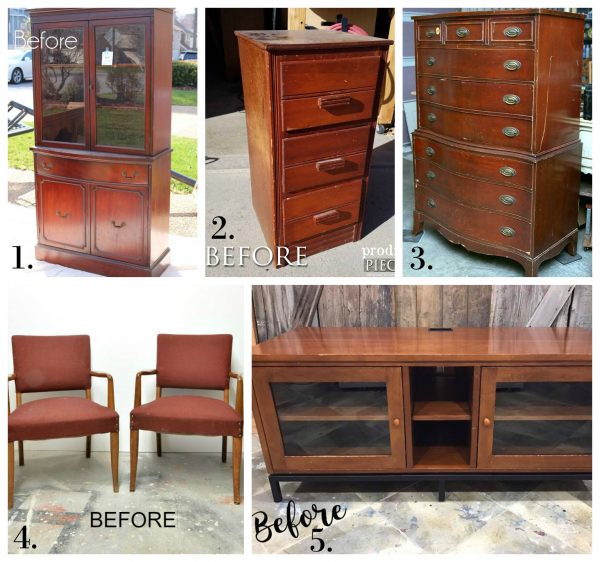
Find the location of `brown wooden bedside drawer with three drawers`. brown wooden bedside drawer with three drawers is located at coordinates (346, 130).